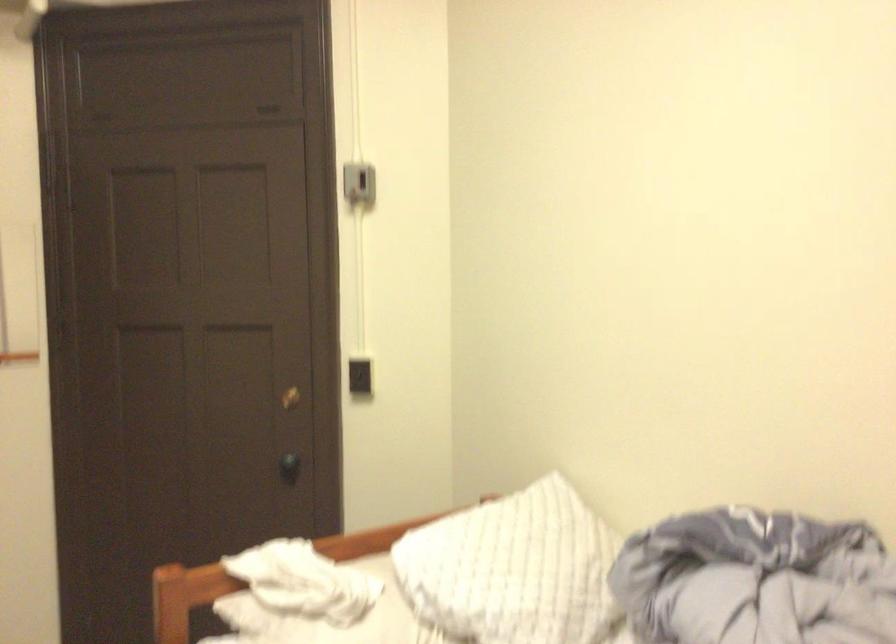
Describe the element at coordinates (289, 467) in the screenshot. I see `a dark door knob` at that location.